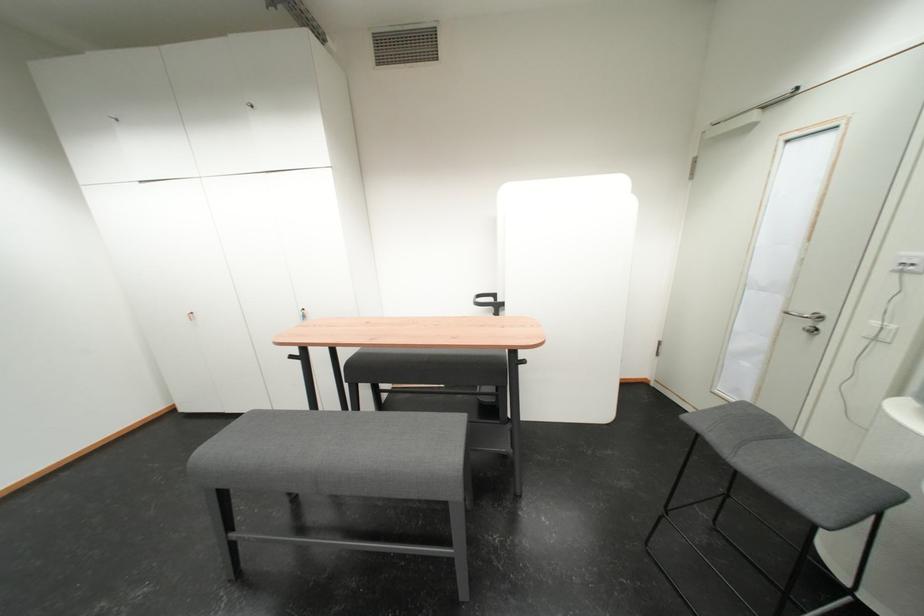
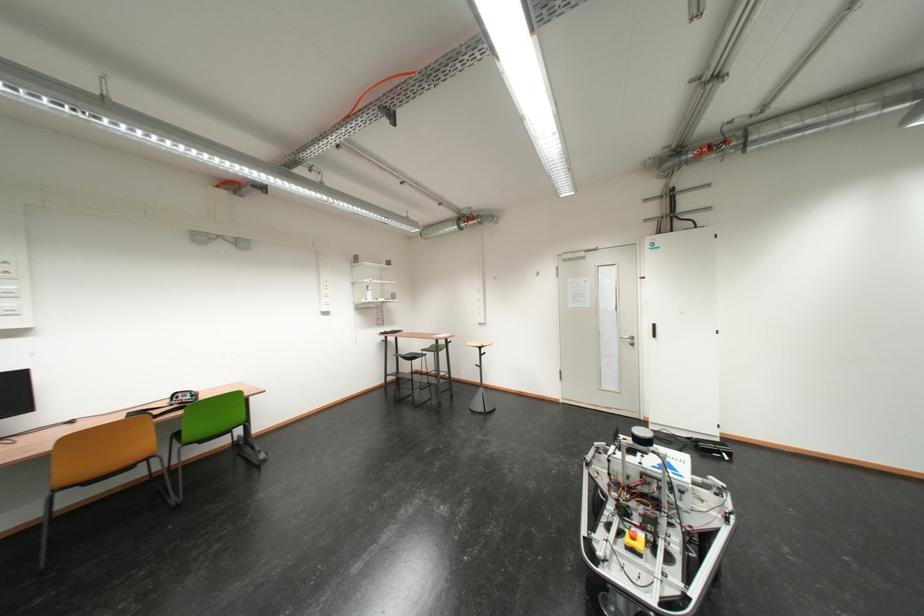
Question: The camera is either moving clockwise (left) or counter-clockwise (right) around the object. The first image is from the beginning of the video and the second image is from the end. Is the camera moving left or right when shooting the video?

Choices:
 (A) Left
 (B) Right

Answer: (B)